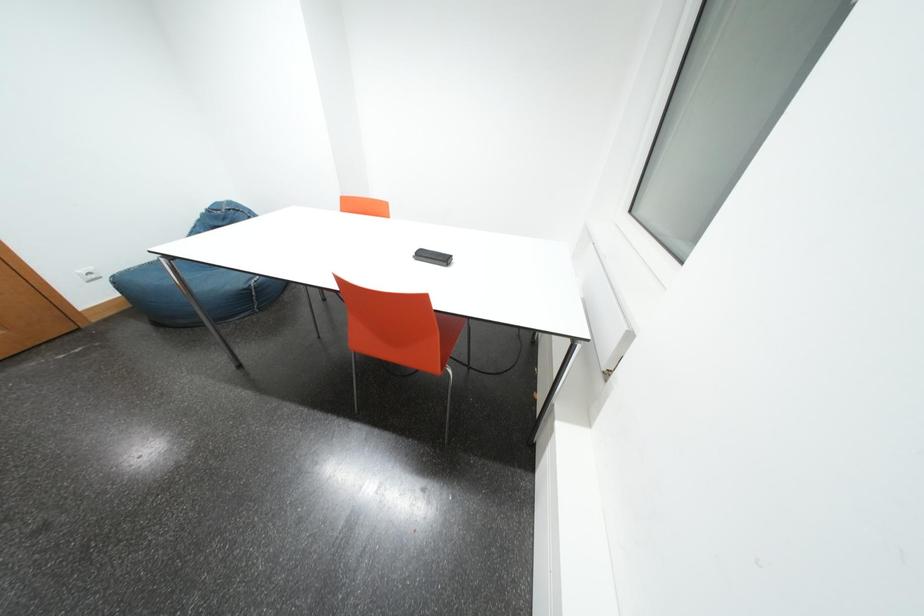
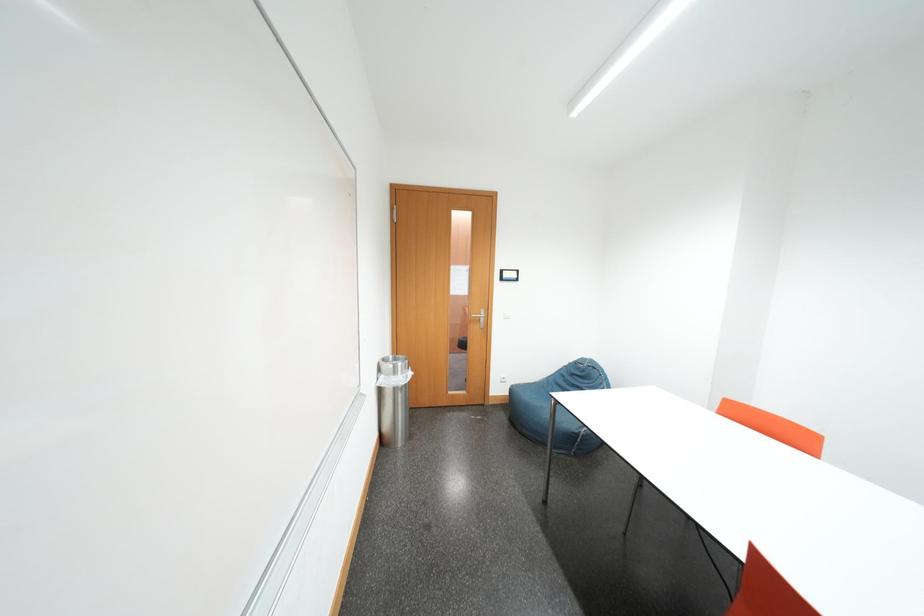
Question: How did the camera likely rotate?

Choices:
 (A) Left
 (B) Right
 (C) Up
 (D) Down

Answer: (A)